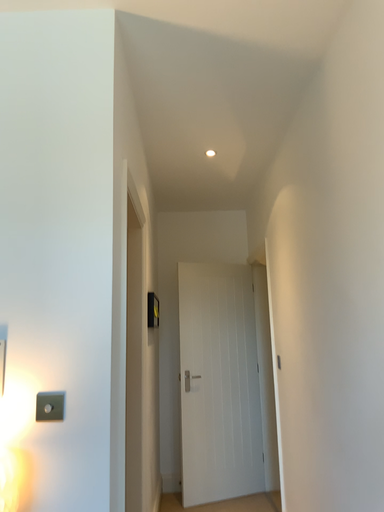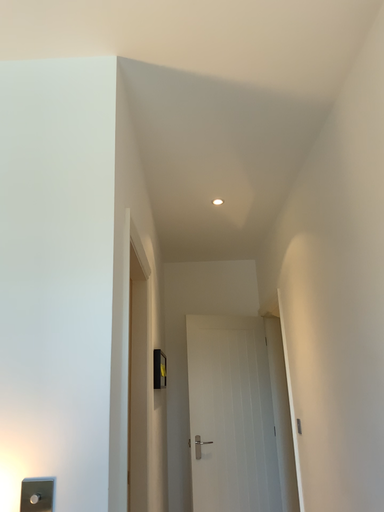
Question: Which way did the camera rotate in the video?

Choices:
 (A) rotated upward
 (B) rotated downward

Answer: (A)